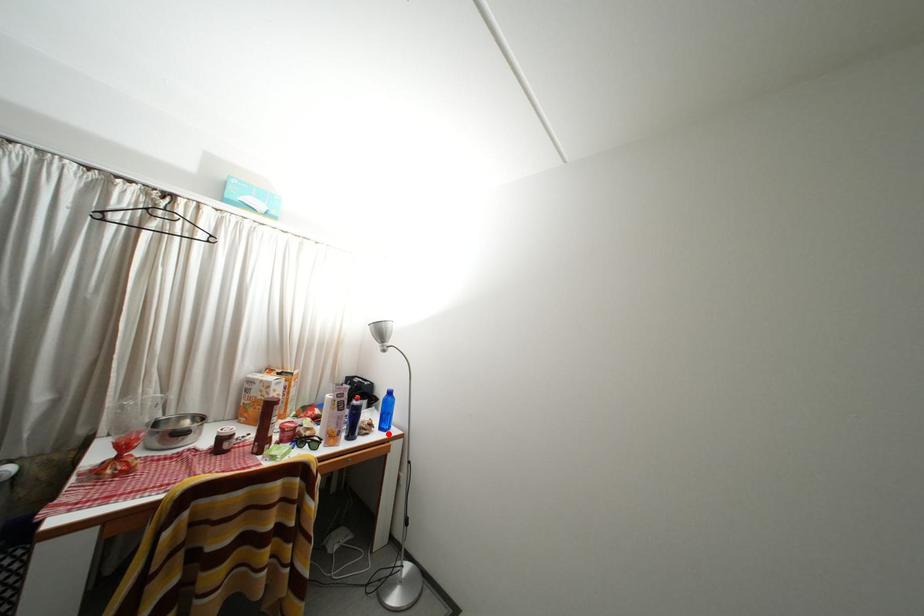
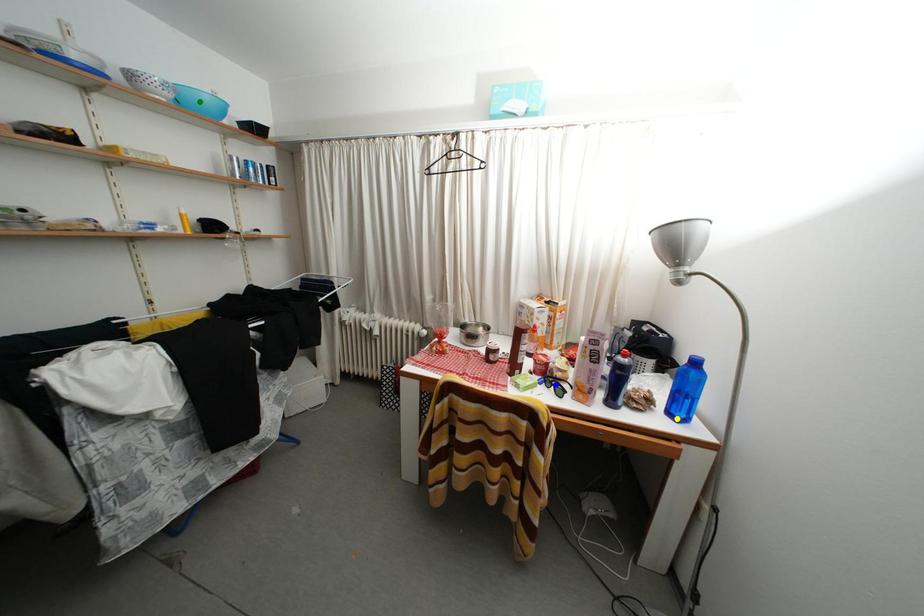
Question: I am providing you with two images of the same scene from different viewpoints. A red point is marked on the first image. You are given multiple points on the second image. Can you choose the point in image 2 that corresponds to the point in image 1?

Choices:
 (A) blue point
 (B) yellow point
 (C) green point

Answer: (B)